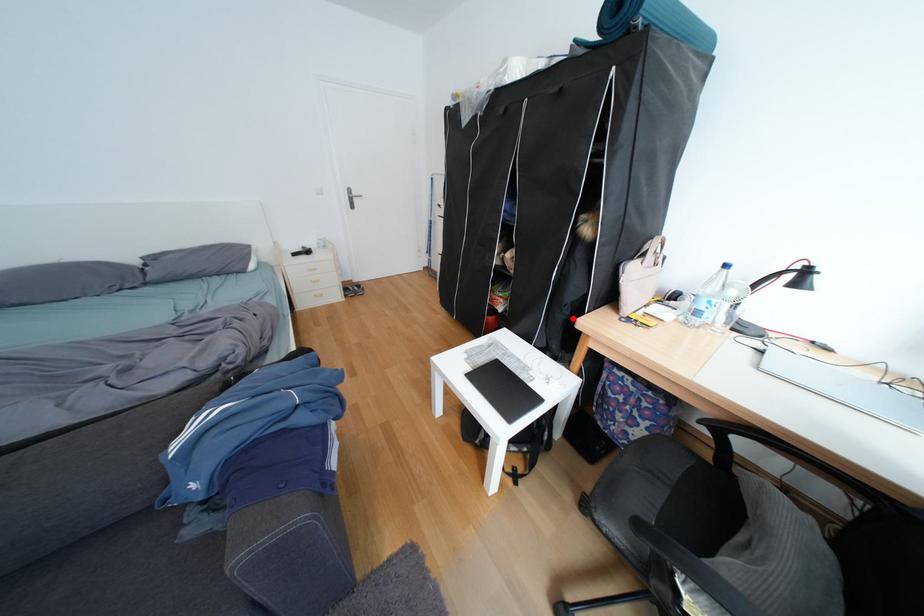
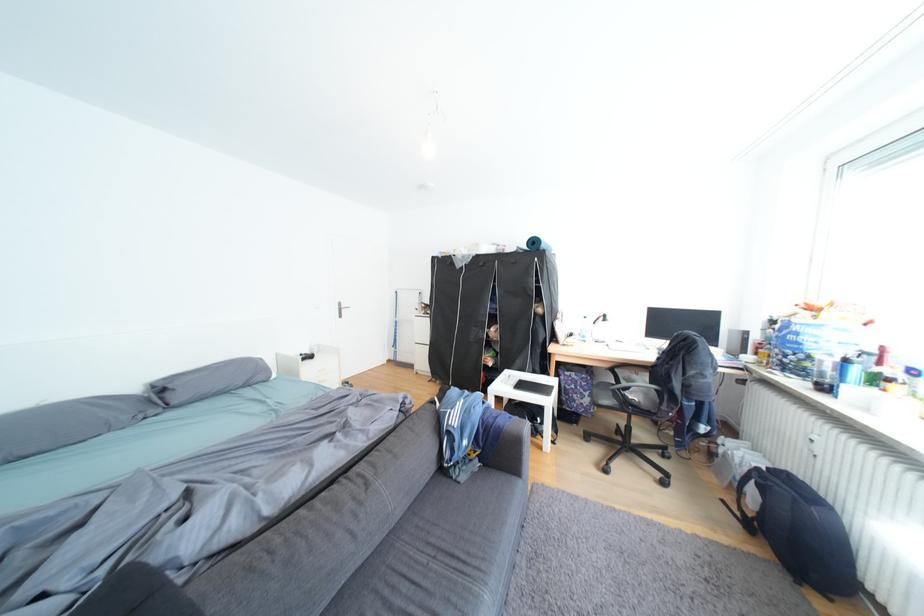
Question: I am providing you with two images of the same scene from different viewpoints. Image1 has a red point marked. In image2, the corresponding 3D location appears at what relative position? Reply with the corresponding letter.

Choices:
 (A) Closer
 (B) Farther

Answer: (B)